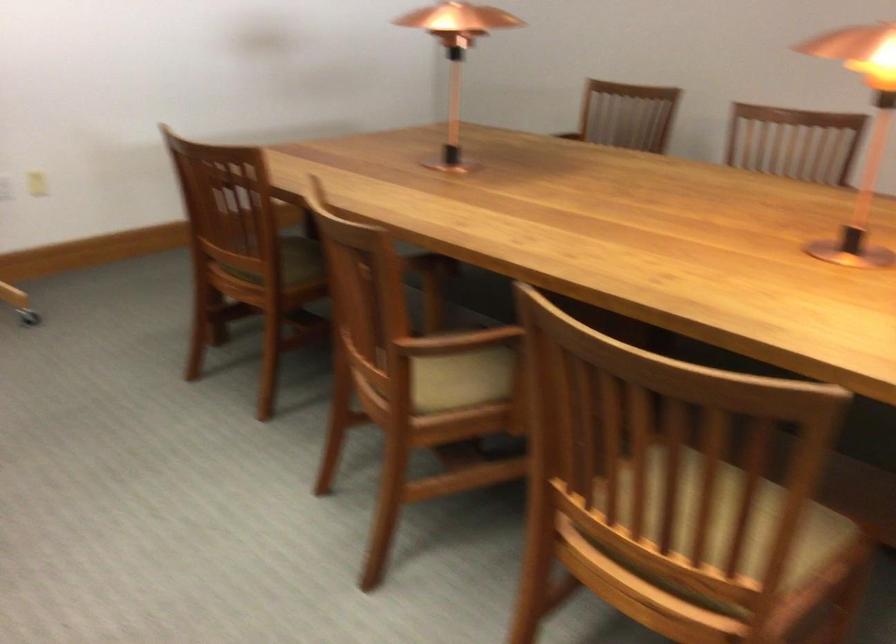
What do you see at coordinates (37, 184) in the screenshot?
I see `the wall light switch` at bounding box center [37, 184].